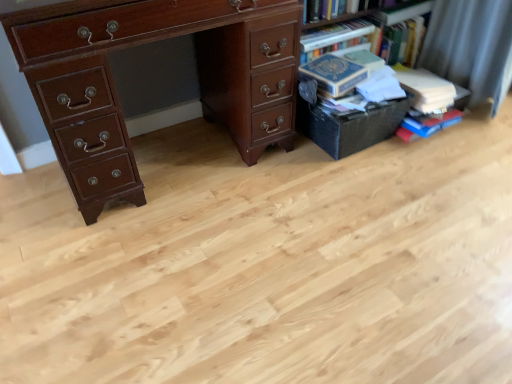
Question: Is black matte box at right completely or partially outside of hardcover books at upper right?

Choices:
 (A) yes
 (B) no

Answer: (A)

Question: Is black matte box at right further to the viewer compared to hardcover books at upper right?

Choices:
 (A) no
 (B) yes

Answer: (A)

Question: Considering the relative sizes of black matte box at right and hardcover books at upper right in the image provided, is black matte box at right wider than hardcover books at upper right?

Choices:
 (A) yes
 (B) no

Answer: (B)

Question: Can you confirm if black matte box at right is taller than hardcover books at upper right?

Choices:
 (A) yes
 (B) no

Answer: (B)

Question: Can you confirm if black matte box at right is positioned to the right of hardcover books at upper right?

Choices:
 (A) yes
 (B) no

Answer: (B)

Question: From the image's perspective, is black matte box at right located above hardcover books at upper right?

Choices:
 (A) no
 (B) yes

Answer: (A)

Question: Is hardcover books at upper right to the right of hardcover book at right, the 2th book positioned from the right, from the viewer's perspective?

Choices:
 (A) yes
 (B) no

Answer: (A)

Question: Is hardcover books at upper right in front of hardcover book at right, positioned as the first book in left-to-right order?

Choices:
 (A) no
 (B) yes

Answer: (A)

Question: Does hardcover books at upper right have a smaller size compared to hardcover book at right, positioned as the first book in left-to-right order?

Choices:
 (A) yes
 (B) no

Answer: (B)

Question: From the image's perspective, is hardcover books at upper right below hardcover book at right, positioned as the first book in left-to-right order?

Choices:
 (A) no
 (B) yes

Answer: (A)

Question: Is hardcover book at right, the 2th book positioned from the right, located within hardcover books at upper right?

Choices:
 (A) yes
 (B) no

Answer: (B)

Question: Is hardcover books at upper right oriented away from hardcover book at right, the 2th book positioned from the right?

Choices:
 (A) no
 (B) yes

Answer: (A)

Question: Is hardcover book at right, the 2th book positioned from the right, facing towards hardcover books at upper right?

Choices:
 (A) yes
 (B) no

Answer: (B)